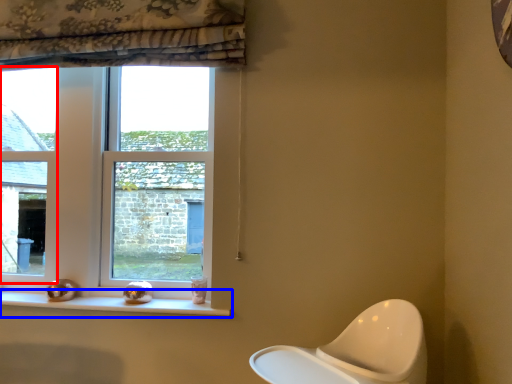
Question: Which of the following is the closest to the observer, window (highlighted by a red box) or window sill (highlighted by a blue box)?

Choices:
 (A) window
 (B) window sill

Answer: (B)